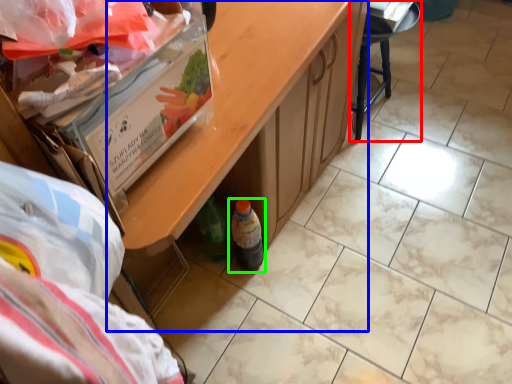
Question: Which object is positioned farthest from furniture (highlighted by a red box)? Select from table (highlighted by a blue box) and bottle (highlighted by a green box).

Choices:
 (A) table
 (B) bottle

Answer: (B)